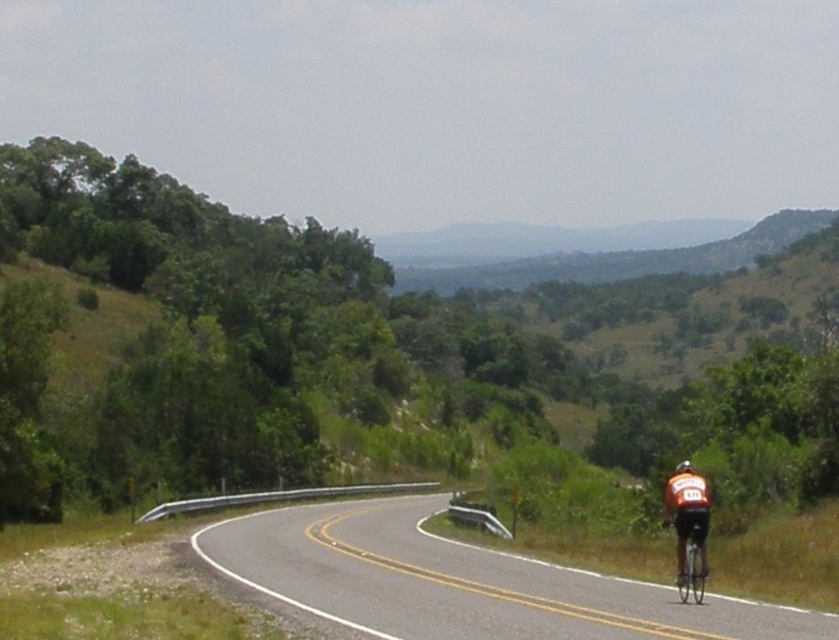
Question: Does asphalt road at center appear on the right side of shiny silver bicycle at right?

Choices:
 (A) no
 (B) yes

Answer: (A)

Question: Which object appears closest to the camera in this image?

Choices:
 (A) orange fabric cyclist at lower right
 (B) asphalt road at center
 (C) shiny orange helmet at right

Answer: (B)

Question: Estimate the real-world distances between objects in this image. Which object is closer to the asphalt road at center?

Choices:
 (A) shiny orange helmet at right
 (B) shiny silver bicycle at right

Answer: (B)

Question: Is asphalt road at center further to the viewer compared to shiny orange helmet at right?

Choices:
 (A) yes
 (B) no

Answer: (B)

Question: In this image, where is asphalt road at center located relative to shiny silver bicycle at right?

Choices:
 (A) right
 (B) left

Answer: (B)

Question: Considering the real-world distances, which object is farthest from the orange fabric cyclist at lower right?

Choices:
 (A) shiny silver bicycle at right
 (B) shiny orange helmet at right
 (C) asphalt road at center

Answer: (C)